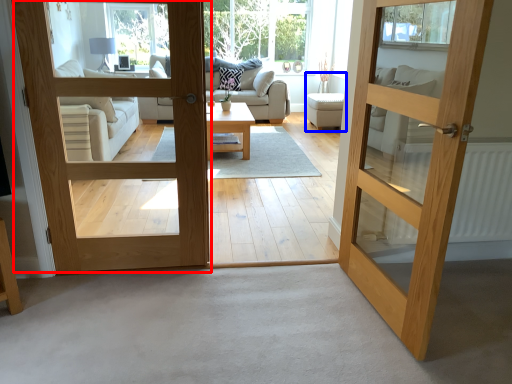
Question: Which of the following is the closest to the observer, door (highlighted by a red box) or armchair (highlighted by a blue box)?

Choices:
 (A) door
 (B) armchair

Answer: (A)